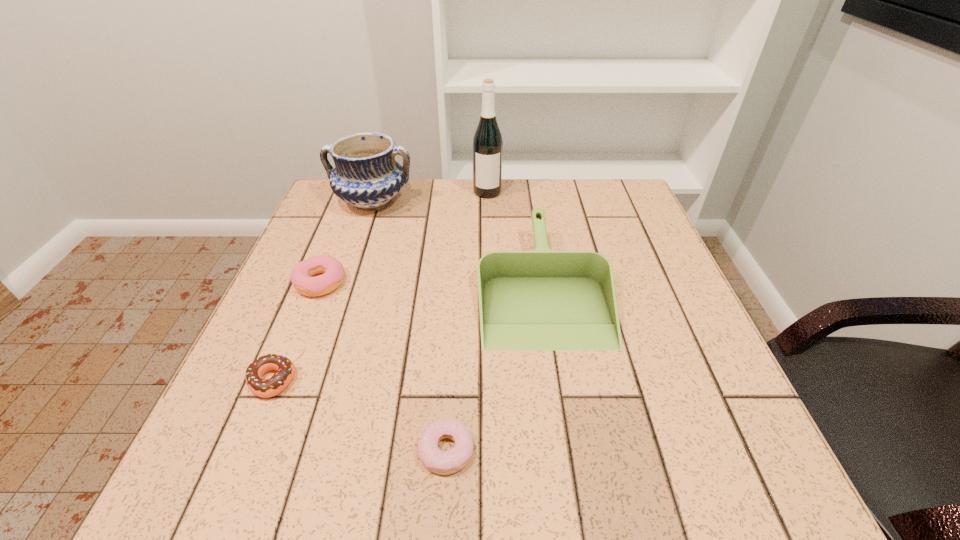
This screenshot has width=960, height=540. Find the location of `vacant region between the shortest doughnut and the fifth farthest object`. vacant region between the shortest doughnut and the fifth farthest object is located at coordinates coord(359,415).

The image size is (960, 540). What are the coordinates of `free space between the tallest object and the dustpan` in the screenshot? It's located at (515, 239).

What are the coordinates of `vacant area between the fifth farthest object and the third shortest object` in the screenshot? It's located at (296, 332).

Locate an element on the screen. This screenshot has height=540, width=960. vacant space that is in between the second tallest object and the third shortest object is located at coordinates (347, 242).

Locate an element on the screen. vacant point located between the pottery and the nearest doughnut is located at coordinates (409, 326).

The image size is (960, 540). What are the coordinates of `object that is the second closest to the fifth farthest object` in the screenshot? It's located at (437, 461).

Point out which object is positioned as the fifth nearest to the farthest doughnut. Please provide its 2D coordinates. Your answer should be formatted as a tuple, i.e. [(x, y)], where the tuple contains the x and y coordinates of a point satisfying the conditions above.

[(487, 142)]

Locate an element on the screen. The width and height of the screenshot is (960, 540). doughnut that can be found as the closest to the wine bottle is located at coordinates coord(301,277).

Where is `the third closest doughnut to the third tallest object`? the third closest doughnut to the third tallest object is located at coordinates click(285, 367).

Locate an element on the screen. The width and height of the screenshot is (960, 540). vacant region that satisfies the following two spatial constraints: 1. on the back side of the second nearest doughnut; 2. on the left side of the pottery is located at coordinates (347, 201).